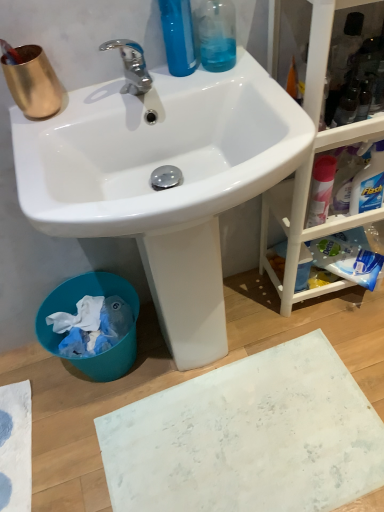
The image size is (384, 512). I want to click on vacant space that is in between white glossy sink at upper center and white wood cabinet at right, so click(x=324, y=324).